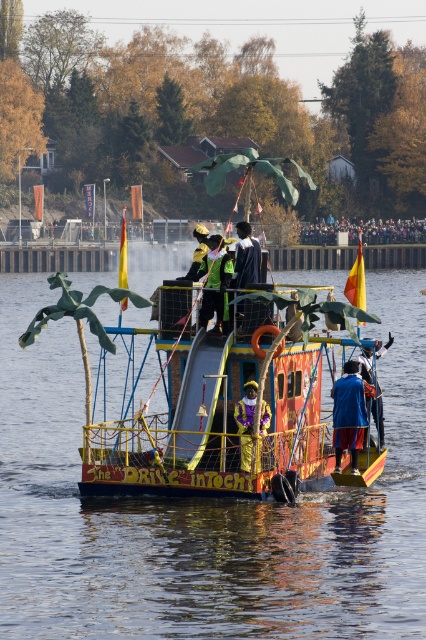
Does multicolored fabric crowd at upper center appear on the left side of blue velvet hat at center?

No, multicolored fabric crowd at upper center is not to the left of blue velvet hat at center.

Is point (319, 227) more distant than point (382, 436)?

Yes, it is.

The height and width of the screenshot is (640, 426). Find the location of `multicolored fabric crowd at upper center`. multicolored fabric crowd at upper center is located at coordinates (363, 230).

Is smooth wooden boat at center thinner than golden fabric figure at center?

No.

Locate an element on the screen. Image resolution: width=426 pixels, height=640 pixels. smooth wooden boat at center is located at coordinates (204, 515).

Who is more distant from viewer, (299, 444) or (339, 221)?

Positioned behind is point (339, 221).

Find the location of a particular element. wooden painted boat at center is located at coordinates (227, 406).

Where is `wooden painted boat at center`? wooden painted boat at center is located at coordinates (227, 406).